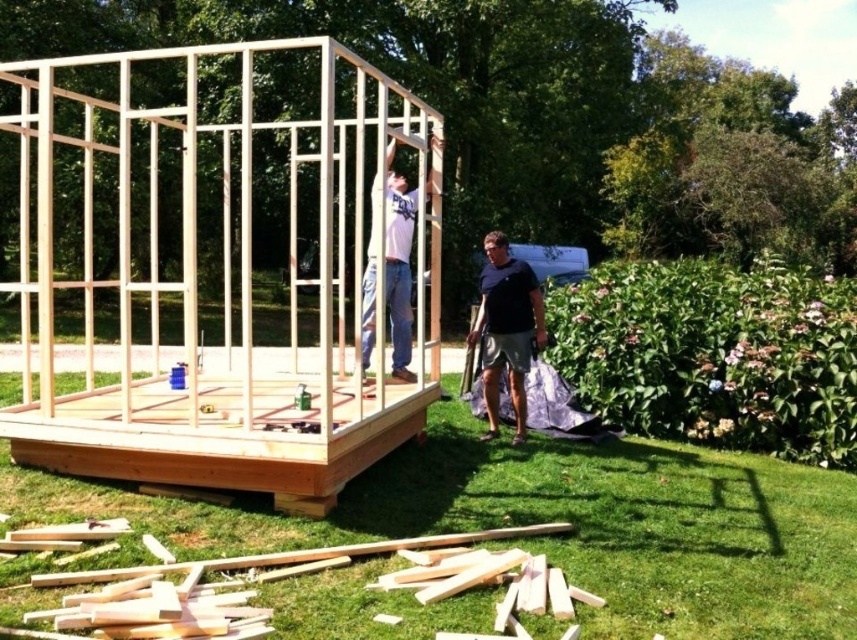
You are a construction worker standing at the edge of the grassy area. You need to place a heavy tool on the ground near the natural wood shed at center without damaging the white matte shirt at center. Where should you place the tool?

The natural wood shed at center is positioned over the white matte shirt at center. Therefore, placing the tool near the shed would also be over the shirt. To avoid damaging the shirt, place the tool on the scattered pieces of wood in the foreground, which are separate from the shirt.

You are standing at the center of the grassy area and want to pick up the light brown wood at lower left. Which direction should you move to reach it?

You should move to the lower left direction to reach the light brown wood at lower left, as it is located at point (283, 576).